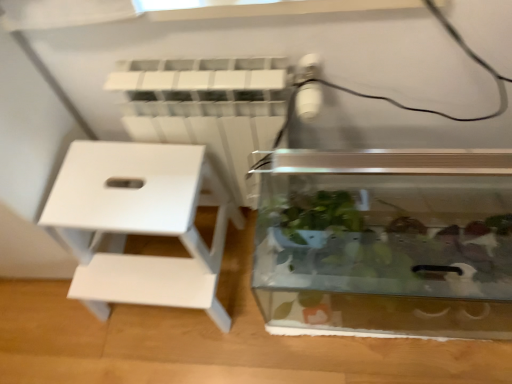
Question: Is transparent glass tank at center wider or thinner than white matte stool at left?

Choices:
 (A) wide
 (B) thin

Answer: (B)

Question: Considering the positions of transparent glass tank at center and white matte stool at left in the image, is transparent glass tank at center taller or shorter than white matte stool at left?

Choices:
 (A) short
 (B) tall

Answer: (A)

Question: Estimate the real-world distances between objects in this image. Which object is closer to the transparent glass tank at center?

Choices:
 (A) white plastic radiator at upper center
 (B) white matte stool at left

Answer: (A)

Question: Estimate the real-world distances between objects in this image. Which object is closer to the white plastic radiator at upper center?

Choices:
 (A) white matte stool at left
 (B) transparent glass tank at center

Answer: (A)